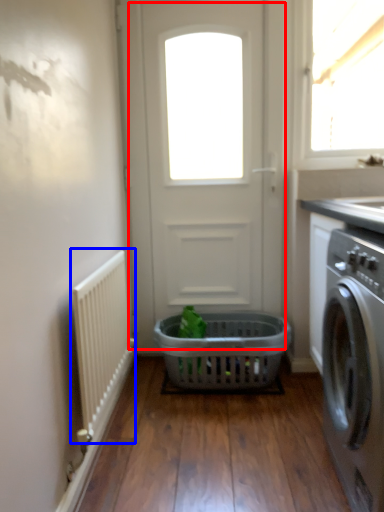
Question: Which object appears farthest to the camera in this image, door (highlighted by a red box) or radiator (highlighted by a blue box)?

Choices:
 (A) door
 (B) radiator

Answer: (A)